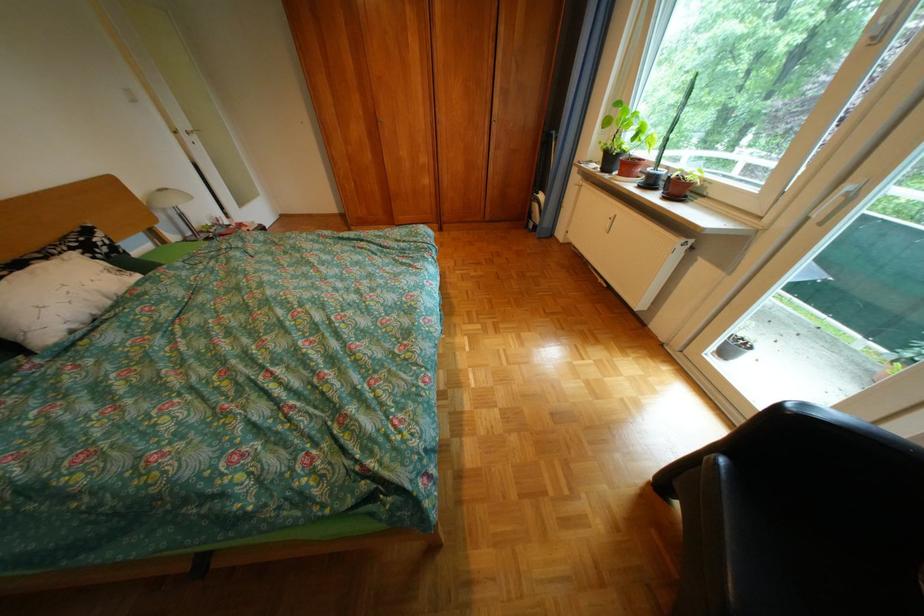
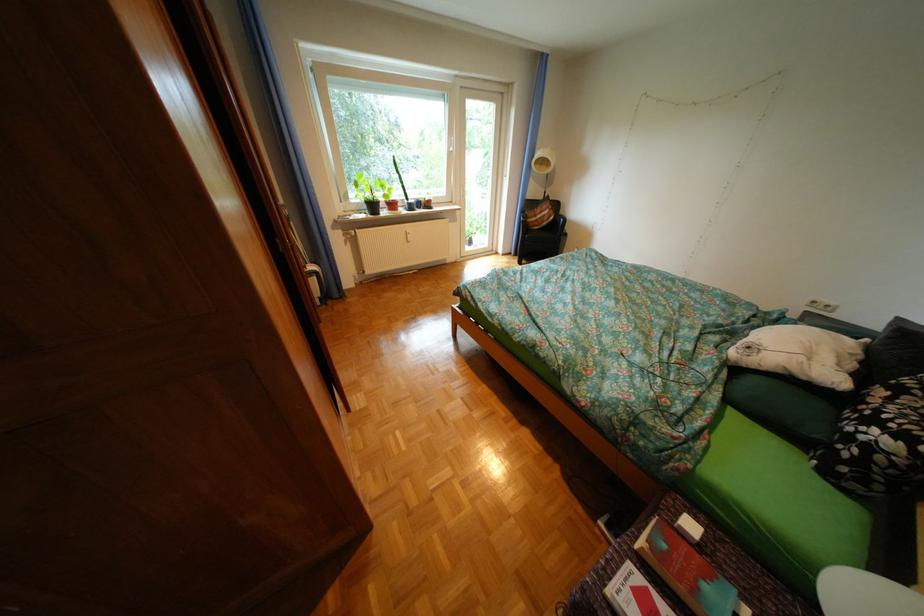
The point at (59,259) is marked in the first image. Where is the corresponding point in the second image?

(904, 399)